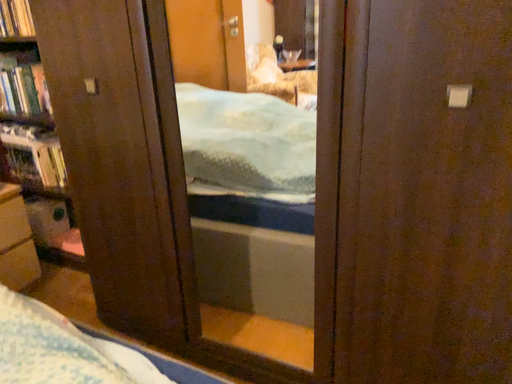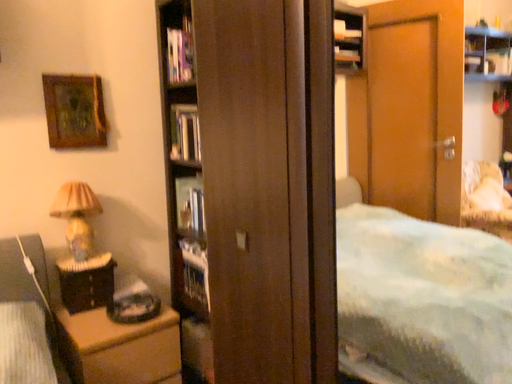
Question: How did the camera likely rotate when shooting the video?

Choices:
 (A) rotated left
 (B) rotated right

Answer: (A)